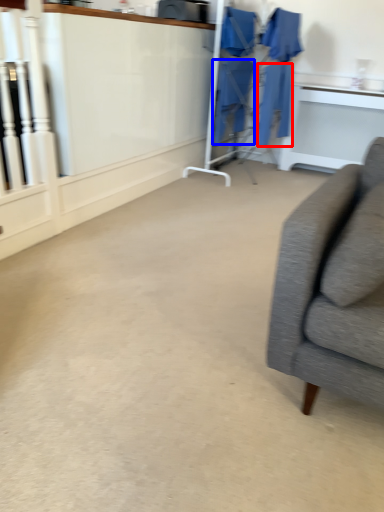
Question: Which object appears closest to the camera in this image, robe (highlighted by a red box) or robe (highlighted by a blue box)?

Choices:
 (A) robe
 (B) robe

Answer: (A)